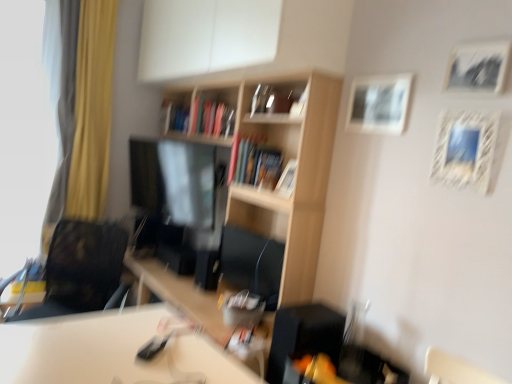
Question: Is hardcover book at center, arranged as the 1th book when viewed from the front, taller or shorter than white textured picture frame at upper right, the 3th picture frame from the back?

Choices:
 (A) tall
 (B) short

Answer: (A)

Question: Relative to white textured picture frame at upper right, the 3th picture frame from the back, is hardcover book at center, the first book positioned from the right, in front or behind?

Choices:
 (A) behind
 (B) front

Answer: (A)

Question: Which of these objects is positioned closest to the white glossy table at lower center?

Choices:
 (A) black matte picture frame at upper right, the fourth picture frame positioned from the back
 (B) transparent glass window screen at left
 (C) yellow fabric curtain at left
 (D) hardcover book at center, the 2th book ordered from the bottom
 (E) white matte cabinet at upper center

Answer: (E)

Question: Which of these objects is positioned closest to the white matte picture frame at upper right, placed as the 3th picture frame when sorted from right to left?

Choices:
 (A) wooden bookshelf at center
 (B) hardcover book at center, which is the second book from right to left
 (C) black matte picture frame at upper right, the fourth picture frame positioned from the back
 (D) white glossy table at lower center
 (E) wooden picture frame at center, the 4th picture frame when ordered from front to back

Answer: (C)